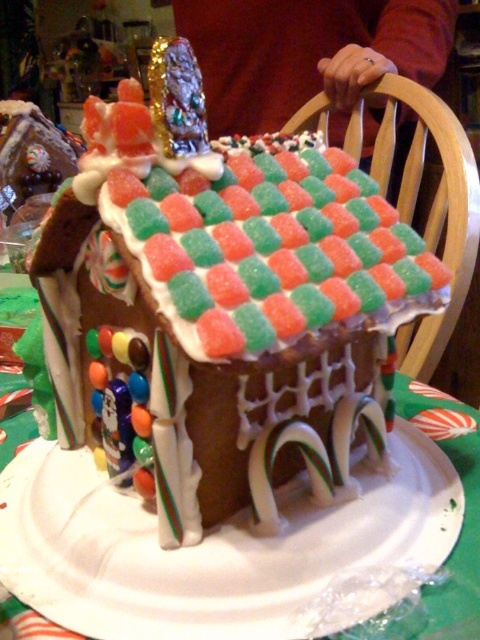
You are a photographer taking a picture of the gingerbread house. You notice two points marked on the image. The first point is at coordinates point (243, 330), and the second is at point (141, 616). If you want to focus on the point that is closer to you, which coordinate should you choose?

Point (243, 330) is closer to the camera than point (141, 616), so you should choose point (243, 330) to focus on the point closer to you.